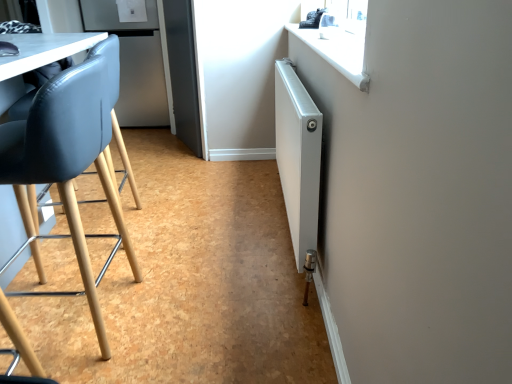
Question: Is matte black chair at left in front of or behind white metallic radiator at right in the image?

Choices:
 (A) front
 (B) behind

Answer: (A)

Question: Looking at the image, does matte black chair at left seem bigger or smaller compared to white metallic radiator at right?

Choices:
 (A) small
 (B) big

Answer: (B)

Question: Which of these objects is positioned farthest from the white metallic radiator at right?

Choices:
 (A) matte black chair at left
 (B) satin silver refrigerator at upper left

Answer: (B)

Question: Estimate the real-world distances between objects in this image. Which object is closer to the matte black chair at left?

Choices:
 (A) satin silver refrigerator at upper left
 (B) white metallic radiator at right

Answer: (B)